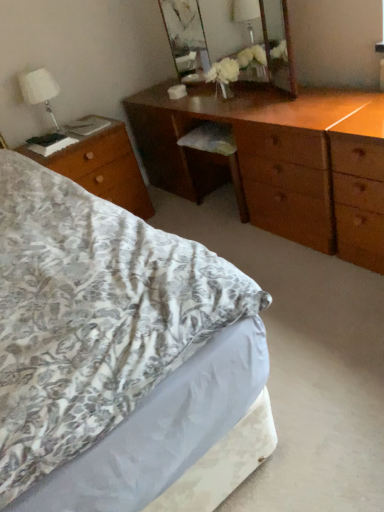
Question: From the image's perspective, is wooden mirror at upper center above wooden desk at left?

Choices:
 (A) yes
 (B) no

Answer: (A)

Question: Can you confirm if wooden mirror at upper center is taller than wooden desk at left?

Choices:
 (A) yes
 (B) no

Answer: (B)

Question: Is wooden mirror at upper center positioned behind wooden desk at left?

Choices:
 (A) yes
 (B) no

Answer: (B)

Question: Is wooden mirror at upper center outside wooden desk at left?

Choices:
 (A) yes
 (B) no

Answer: (A)

Question: From the image's perspective, is wooden mirror at upper center located beneath wooden desk at left?

Choices:
 (A) yes
 (B) no

Answer: (B)

Question: Looking at the image, does floral fabric bed at lower left seem bigger or smaller compared to wooden desk at left?

Choices:
 (A) big
 (B) small

Answer: (A)

Question: From the image's perspective, is floral fabric bed at lower left located above or below wooden desk at left?

Choices:
 (A) above
 (B) below

Answer: (B)

Question: Is floral fabric bed at lower left in front of or behind wooden desk at left in the image?

Choices:
 (A) front
 (B) behind

Answer: (A)

Question: Considering the positions of point (76, 401) and point (117, 125), is point (76, 401) closer or farther from the camera than point (117, 125)?

Choices:
 (A) closer
 (B) farther

Answer: (A)

Question: From the image's perspective, is shiny brown dresser at center located above or below white fabric lampshade at upper left?

Choices:
 (A) below
 (B) above

Answer: (A)

Question: Does point (135, 126) appear closer or farther from the camera than point (39, 79)?

Choices:
 (A) closer
 (B) farther

Answer: (B)

Question: Would you say shiny brown dresser at center is to the left or to the right of white fabric lampshade at upper left in the picture?

Choices:
 (A) left
 (B) right

Answer: (B)

Question: Is shiny brown dresser at center wider or thinner than white fabric lampshade at upper left?

Choices:
 (A) thin
 (B) wide

Answer: (B)

Question: Is wooden desk at left in front of or behind shiny brown dresser at center in the image?

Choices:
 (A) front
 (B) behind

Answer: (B)

Question: Is wooden desk at left bigger or smaller than shiny brown dresser at center?

Choices:
 (A) small
 (B) big

Answer: (A)